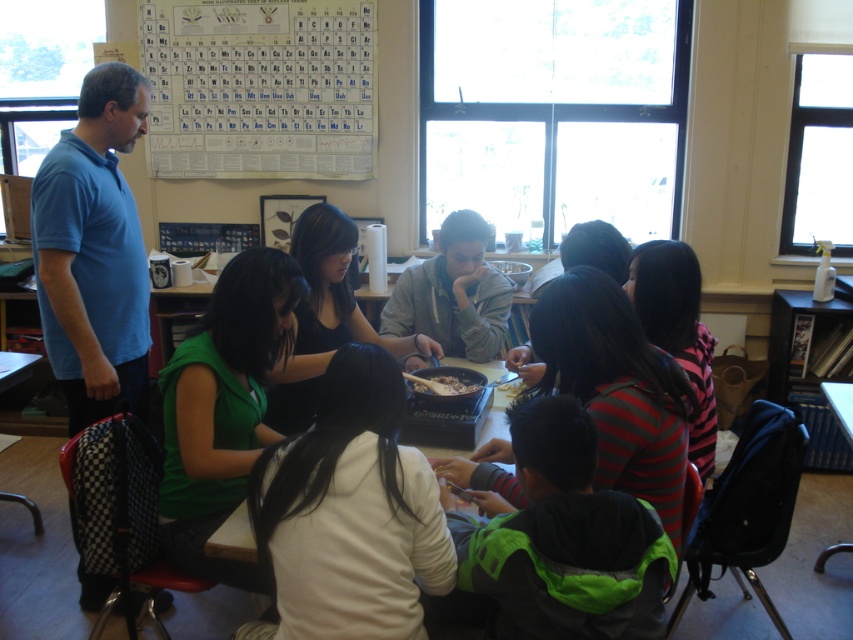
Question: Among these points, which one is nearest to the camera?

Choices:
 (A) (447, 376)
 (B) (321, 51)

Answer: (A)

Question: Estimate the real-world distances between objects in this image. Which object is farther from the gray matte jacket at center?

Choices:
 (A) white paper at upper center
 (B) blue cotton shirt at left
 (C) wooden table at center
 (D) brown matte food at center

Answer: (A)

Question: Is white paper at upper center positioned at the back of brown matte food at center?

Choices:
 (A) no
 (B) yes

Answer: (B)

Question: Is gray matte jacket at center above brown matte food at center?

Choices:
 (A) yes
 (B) no

Answer: (A)

Question: Which is nearer to the wooden table at center?

Choices:
 (A) blue cotton shirt at left
 (B) white paper at upper center
 (C) gray matte jacket at center
 (D) brown matte food at center

Answer: (D)

Question: Does wooden table at center come behind blue cotton shirt at left?

Choices:
 (A) no
 (B) yes

Answer: (A)